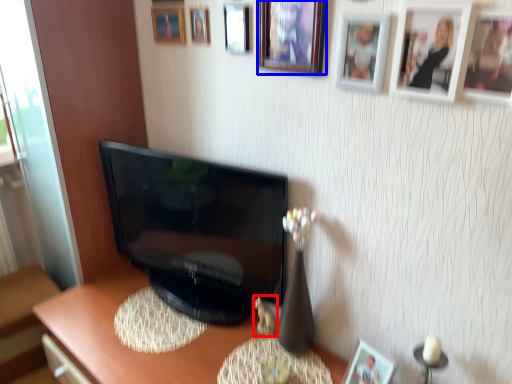
Question: Which of the following is the farthest to the observer, toy (highlighted by a red box) or picture frame (highlighted by a blue box)?

Choices:
 (A) toy
 (B) picture frame

Answer: (A)